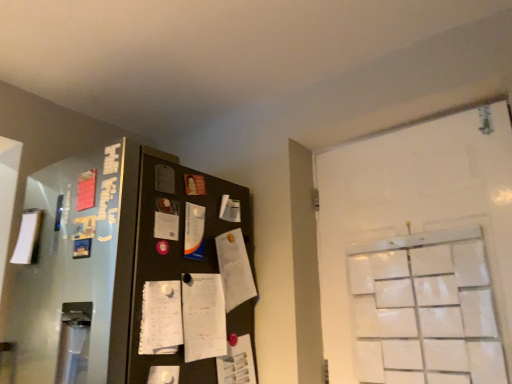
Measure the distance between white matte door at right and camera.

white matte door at right and camera are 1.37 meters apart from each other.

This screenshot has width=512, height=384. In order to click on white matte door at right in this screenshot , I will do `click(418, 253)`.

Considering the sizes of objects white matte door at right and white paper at center, which is counted as the third paper, starting from the top, in the image provided, who is shorter, white matte door at right or white paper at center, which is counted as the third paper, starting from the top,?

white paper at center, which is counted as the third paper, starting from the top.

Considering the relative positions of white matte door at right and white paper at center, the first paper from the bottom, in the image provided, is white matte door at right behind white paper at center, the first paper from the bottom,?

That is False.

How much distance is there between white matte door at right and white paper at center, acting as the third paper starting from the left?

white matte door at right and white paper at center, acting as the third paper starting from the left, are 28.42 inches apart from each other.

Can you see white matte door at right touching white paper at center, the first paper from the bottom?

white matte door at right and white paper at center, the first paper from the bottom, are not in contact.

How many degrees apart are the facing directions of white paper notepad at center and white matte paper at left, placed as the 2th paper when sorted from bottom to top?

The angle between the facing direction of white paper notepad at center and the facing direction of white matte paper at left, placed as the 2th paper when sorted from bottom to top, is 179 degrees.

Consider the image. Is white paper notepad at center at the right side of white matte paper at left, which is the first paper from left to right?

Yes, white paper notepad at center is to the right of white matte paper at left, which is the first paper from left to right.

In terms of size, does white paper notepad at center appear bigger or smaller than white matte paper at left, the 2th paper when ordered from top to bottom?

Clearly, white paper notepad at center is larger in size than white matte paper at left, the 2th paper when ordered from top to bottom.

From the image's perspective, is white paper notepad at center over white matte paper at left, which is the first paper from left to right?

Incorrect, from the image's perspective, white paper notepad at center is lower than white matte paper at left, which is the first paper from left to right.

Which is behind, white paper notepad at center or white matte door at right?

white paper notepad at center is further from the camera.

Is white paper notepad at center wider or thinner than white matte door at right?

In the image, white paper notepad at center appears to be more narrow than white matte door at right.

From the image's perspective, which is below, white paper notepad at center or white matte door at right?

white paper notepad at center appears lower in the image.

Looking at this image, is white paper notepad at center positioned with its back to white matte door at right?

white paper notepad at center does not have its back to white matte door at right.

You are a GUI agent. You are given a task and a screenshot of the screen. Output one action in this format:
    pyautogui.click(x=<x>, y=<y>)
    Task: Click on the paper below the white paper notepad at center (from the image's perspective)
    This screenshot has width=512, height=384.
    Given the screenshot: What is the action you would take?
    pyautogui.click(x=237, y=362)

Is white paper notepad at center looking in the opposite direction of white paper at center, which is counted as the third paper, starting from the top?

No, white paper notepad at center is not facing the opposite direction of white paper at center, which is counted as the third paper, starting from the top.

In the scene shown: Considering the positions of objects white paper notepad at center and white paper at center, positioned as the first paper in right-to-left order, in the image provided, who is in front, white paper notepad at center or white paper at center, positioned as the first paper in right-to-left order,?

Positioned in front is white paper notepad at center.

Measure the distance between white paper notepad at center and white paper at center, the first paper from the bottom.

white paper notepad at center and white paper at center, the first paper from the bottom, are 6.17 inches apart from each other.

I want to click on paper below the white matte paper at left, placed as the 2th paper when sorted from bottom to top (from the image's perspective), so click(237, 362).

Is white paper at center, positioned as the first paper in right-to-left order, in front of or behind white matte paper at left, positioned as the third paper in right-to-left order, in the image?

In the image, white paper at center, positioned as the first paper in right-to-left order, appears in front of white matte paper at left, positioned as the third paper in right-to-left order.

Is white paper at center, positioned as the first paper in right-to-left order, with white matte paper at left, placed as the 2th paper when sorted from bottom to top?

There is a gap between white paper at center, positioned as the first paper in right-to-left order, and white matte paper at left, placed as the 2th paper when sorted from bottom to top.

Considering the sizes of white glossy paper at center, the second paper viewed from the left, and white paper at center, positioned as the first paper in right-to-left order, in the image, is white glossy paper at center, the second paper viewed from the left, bigger or smaller than white paper at center, positioned as the first paper in right-to-left order,?

white glossy paper at center, the second paper viewed from the left, is smaller than white paper at center, positioned as the first paper in right-to-left order.

Who is shorter, white glossy paper at center, the second paper when ordered from right to left, or white paper at center, the first paper from the bottom?

Standing shorter between the two is white glossy paper at center, the second paper when ordered from right to left.

What's the angular difference between white glossy paper at center, the second paper when ordered from right to left, and white paper at center, which is counted as the third paper, starting from the top,'s facing directions?

0.000619 degrees separate the facing orientations of white glossy paper at center, the second paper when ordered from right to left, and white paper at center, which is counted as the third paper, starting from the top.

From a real-world perspective, is white glossy paper at center, acting as the first paper starting from the top, beneath white paper at center, the first paper from the bottom?

No, from a real-world perspective, white glossy paper at center, acting as the first paper starting from the top, is not under white paper at center, the first paper from the bottom.

Which of these two, white glossy paper at center, the second paper viewed from the left, or white paper notepad at center, is wider?

Wider between the two is white paper notepad at center.

Considering the sizes of white glossy paper at center, acting as the first paper starting from the top, and white paper notepad at center in the image, is white glossy paper at center, acting as the first paper starting from the top, bigger or smaller than white paper notepad at center?

In the image, white glossy paper at center, acting as the first paper starting from the top, appears to be smaller than white paper notepad at center.

Is white glossy paper at center, the second paper when ordered from right to left, closer to the viewer compared to white paper notepad at center?

No, white glossy paper at center, the second paper when ordered from right to left, is further to the viewer.

How many degrees apart are the facing directions of white glossy paper at center, the second paper viewed from the left, and white paper notepad at center?

The facing directions of white glossy paper at center, the second paper viewed from the left, and white paper notepad at center are 0.00433 degrees apart.

You are a GUI agent. You are given a task and a screenshot of the screen. Output one action in this format:
    pyautogui.click(x=<x>, y=<y>)
    Task: Click on the door lying on the right of white paper at center, positioned as the first paper in right-to-left order
    This screenshot has width=512, height=384.
    Given the screenshot: What is the action you would take?
    pyautogui.click(x=418, y=253)

The height and width of the screenshot is (384, 512). I want to click on the 2nd paper to the left when counting from the white paper notepad at center, so click(28, 238).

When comparing their distances from white paper notepad at center, does white matte paper at left, which is the first paper from left to right, or white paper at center, positioned as the first paper in right-to-left order, seem closer?

white paper at center, positioned as the first paper in right-to-left order, lies closer to white paper notepad at center than the other object.

Based on their spatial positions, is white paper notepad at center or white paper at center, the first paper from the bottom, closer to white matte paper at left, which is the first paper from left to right?

Based on the image, white paper notepad at center appears to be nearer to white matte paper at left, which is the first paper from left to right.

When comparing their distances from white matte door at right, does white matte paper at left, the 2th paper when ordered from top to bottom, or white paper notepad at center seem further?

white matte paper at left, the 2th paper when ordered from top to bottom.

From the image, which object appears to be farther from white matte paper at left, which is the first paper from left to right, white matte door at right or white glossy paper at center, which is the third paper in bottom-to-top order?

white matte door at right is further to white matte paper at left, which is the first paper from left to right.

Based on their spatial positions, is white paper at center, the first paper from the bottom, or white glossy paper at center, acting as the first paper starting from the top, closer to white matte paper at left, which is the first paper from left to right?

white glossy paper at center, acting as the first paper starting from the top.

Looking at this image, which object lies further to the anchor point white matte door at right, white paper notepad at center or white glossy paper at center, which is the third paper in bottom-to-top order?

white glossy paper at center, which is the third paper in bottom-to-top order, lies further to white matte door at right than the other object.

Looking at this image, which object lies further to the anchor point white glossy paper at center, acting as the first paper starting from the top, white matte door at right or white matte paper at left, the 2th paper when ordered from top to bottom?

The object further to white glossy paper at center, acting as the first paper starting from the top, is white matte door at right.

Consider the image. From the image, which object appears to be nearer to white glossy paper at center, the second paper when ordered from right to left, white paper at center, which is counted as the third paper, starting from the top, or white paper notepad at center?

white paper notepad at center.

Find the location of a particular element. Image resolution: width=512 pixels, height=384 pixels. notepad situated between white matte paper at left, placed as the 2th paper when sorted from bottom to top, and white matte door at right from left to right is located at coordinates (203, 317).

This screenshot has height=384, width=512. I want to click on paper located between white matte paper at left, placed as the 2th paper when sorted from bottom to top, and white paper notepad at center in the left-right direction, so click(x=194, y=231).

Locate an element on the screen. Image resolution: width=512 pixels, height=384 pixels. paper situated between white matte paper at left, which is the first paper from left to right, and white paper at center, the first paper from the bottom, from left to right is located at coordinates (194, 231).

Locate an element on the screen. paper between white paper notepad at center and white matte door at right is located at coordinates (237, 362).